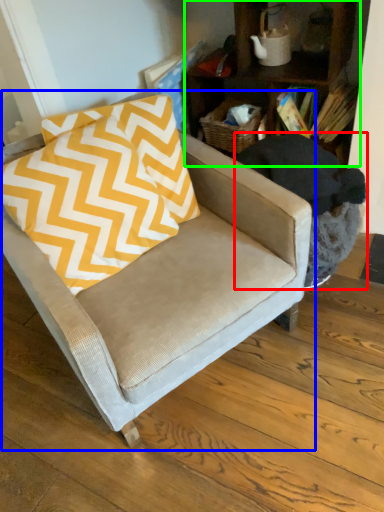
Question: Based on their relative distances, which object is nearer to swivel chair (highlighted by a red box)? Choose from chair (highlighted by a blue box) and bookcase (highlighted by a green box).

Choices:
 (A) chair
 (B) bookcase

Answer: (A)